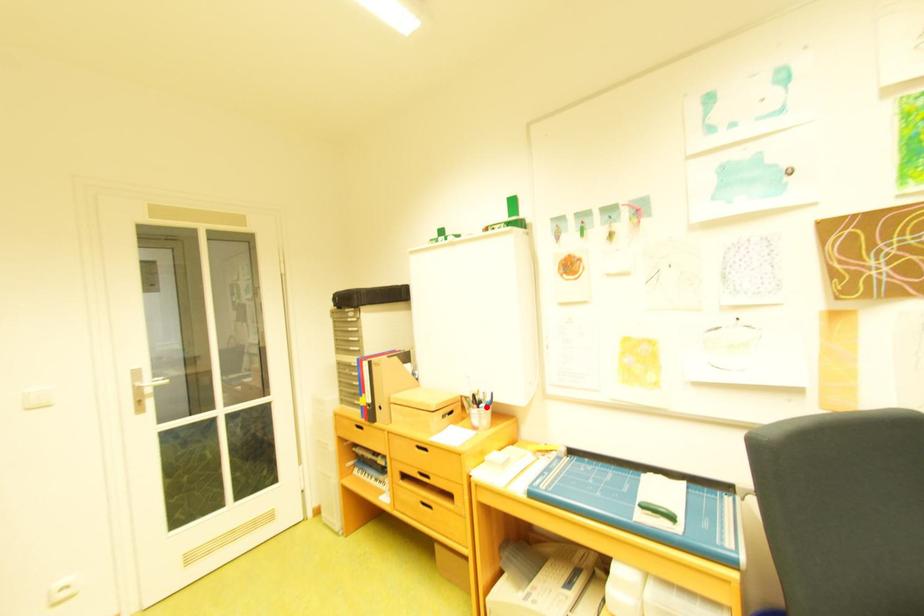
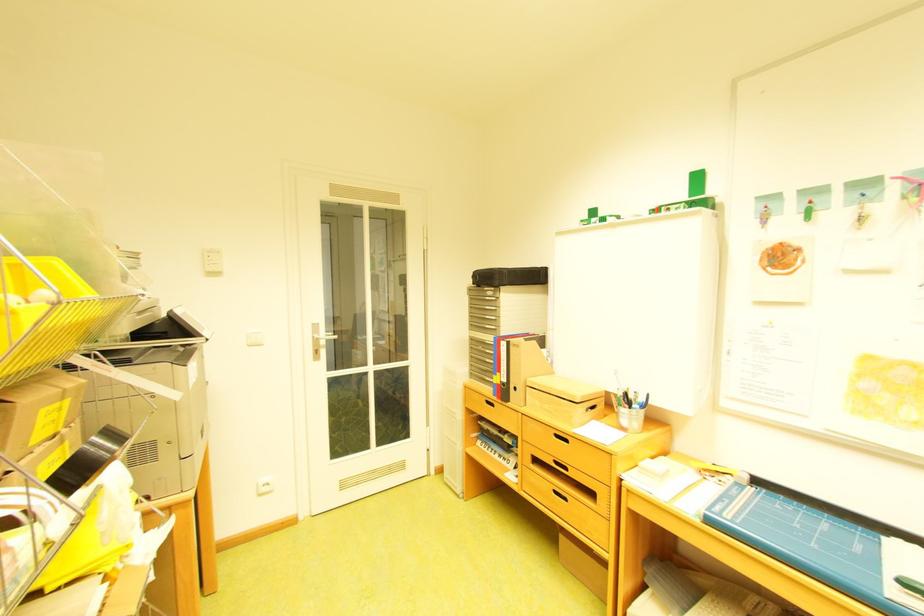
Question: I am providing you with two images of the same scene from different viewpoints. A red point is marked on the first image. Is the red point's position out of view in image 2?

Choices:
 (A) Yes
 (B) No

Answer: (B)